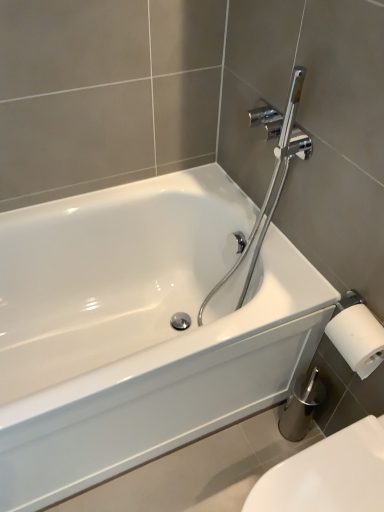
Question: Can you confirm if chrome/polished metal showerhead at upper right is thinner than white glossy toilet at lower right?

Choices:
 (A) no
 (B) yes

Answer: (B)

Question: Could white glossy toilet at lower right be considered to be inside chrome/polished metal showerhead at upper right?

Choices:
 (A) no
 (B) yes

Answer: (A)

Question: Does chrome/polished metal showerhead at upper right have a smaller size compared to white glossy toilet at lower right?

Choices:
 (A) yes
 (B) no

Answer: (B)

Question: Does chrome/polished metal showerhead at upper right have a lesser height compared to white glossy toilet at lower right?

Choices:
 (A) no
 (B) yes

Answer: (A)

Question: Is chrome/polished metal showerhead at upper right wider than white glossy toilet at lower right?

Choices:
 (A) yes
 (B) no

Answer: (B)

Question: In terms of height, does chrome/polished metal showerhead at upper right look taller or shorter compared to white glossy bathtub at center?

Choices:
 (A) short
 (B) tall

Answer: (B)

Question: Is point (248, 279) closer or farther from the camera than point (331, 295)?

Choices:
 (A) farther
 (B) closer

Answer: (A)

Question: Is chrome/polished metal showerhead at upper right in front of or behind white glossy bathtub at center in the image?

Choices:
 (A) behind
 (B) front

Answer: (A)

Question: Based on their positions, is chrome/polished metal showerhead at upper right located to the left or right of white glossy bathtub at center?

Choices:
 (A) right
 (B) left

Answer: (A)

Question: Looking at the image, does white glossy bathtub at center seem bigger or smaller compared to white glossy toilet at lower right?

Choices:
 (A) small
 (B) big

Answer: (B)

Question: Considering the positions of white glossy bathtub at center and white glossy toilet at lower right in the image, is white glossy bathtub at center wider or thinner than white glossy toilet at lower right?

Choices:
 (A) thin
 (B) wide

Answer: (B)

Question: Visually, is white glossy bathtub at center positioned to the left or to the right of white glossy toilet at lower right?

Choices:
 (A) left
 (B) right

Answer: (A)

Question: From a real-world perspective, is white glossy bathtub at center positioned above or below white glossy toilet at lower right?

Choices:
 (A) below
 (B) above

Answer: (B)

Question: From their relative heights in the image, would you say white glossy bathtub at center is taller or shorter than chrome/polished metal showerhead at upper right?

Choices:
 (A) tall
 (B) short

Answer: (B)

Question: Relative to chrome/polished metal showerhead at upper right, is white glossy bathtub at center in front or behind?

Choices:
 (A) behind
 (B) front

Answer: (B)